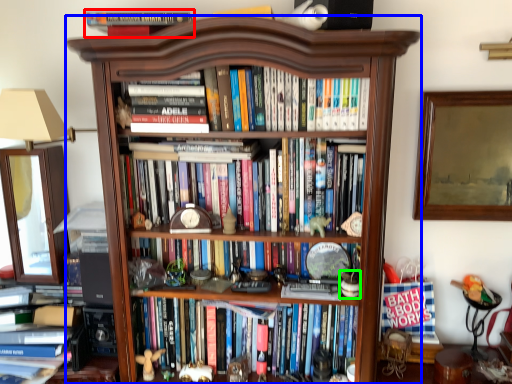
Question: Considering the real-world distances, which object is closest to book (highlighted by a red box)? bookcase (highlighted by a blue box) or toy (highlighted by a green box).

Choices:
 (A) bookcase
 (B) toy

Answer: (A)